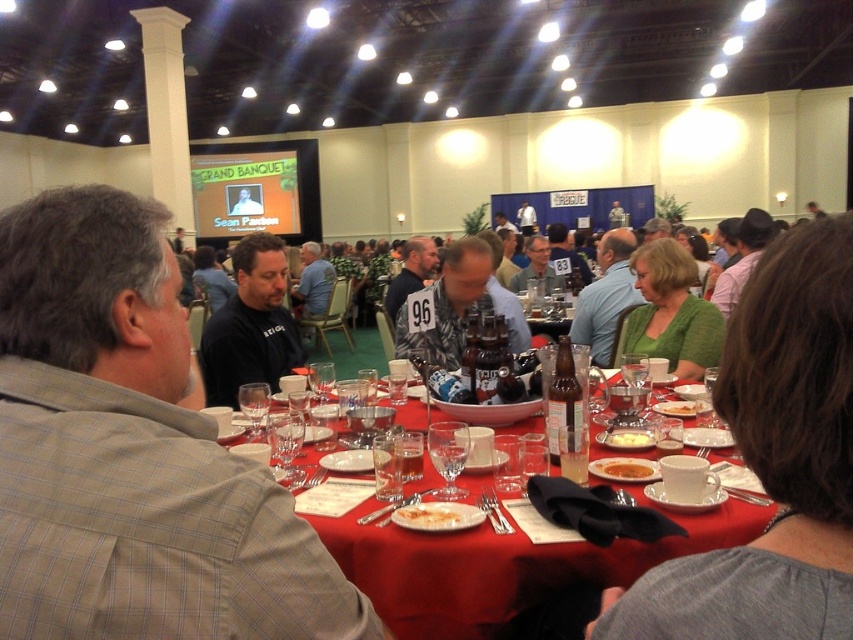
You are a photographer at the event and want to capture a photo of both the green knitwear at center and the camouflage shirt at center without any obstruction. Based on their heights, which one might you need to adjust your camera angle to see over?

The green knitwear at center is shorter than the camouflage shirt at center, so you would need to adjust your camera angle to see over the camouflage shirt at center.

You are organizing a small dinner party and need to place a green knitted sweater at center on the red cloth table at center. Can the sweater fit entirely on the table without hanging over the edges?

The red cloth table at center is wider than the green knitted sweater at center, so the sweater can fit entirely on the table without hanging over the edges.